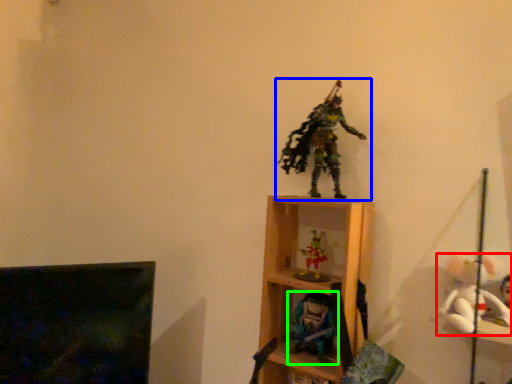
Question: Which is farther away from toy (highlighted by a red box)? toy (highlighted by a blue box) or toy (highlighted by a green box)?

Choices:
 (A) toy
 (B) toy

Answer: (A)